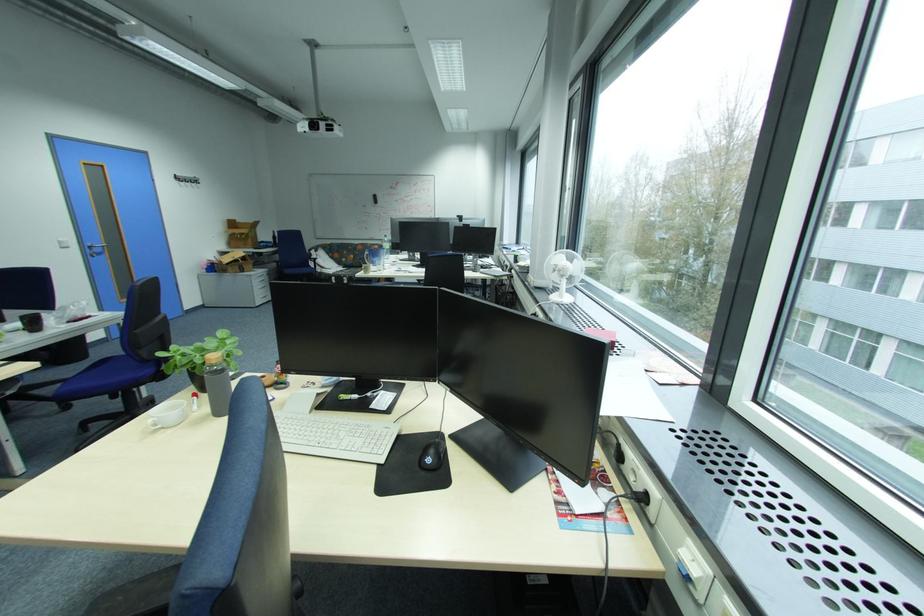
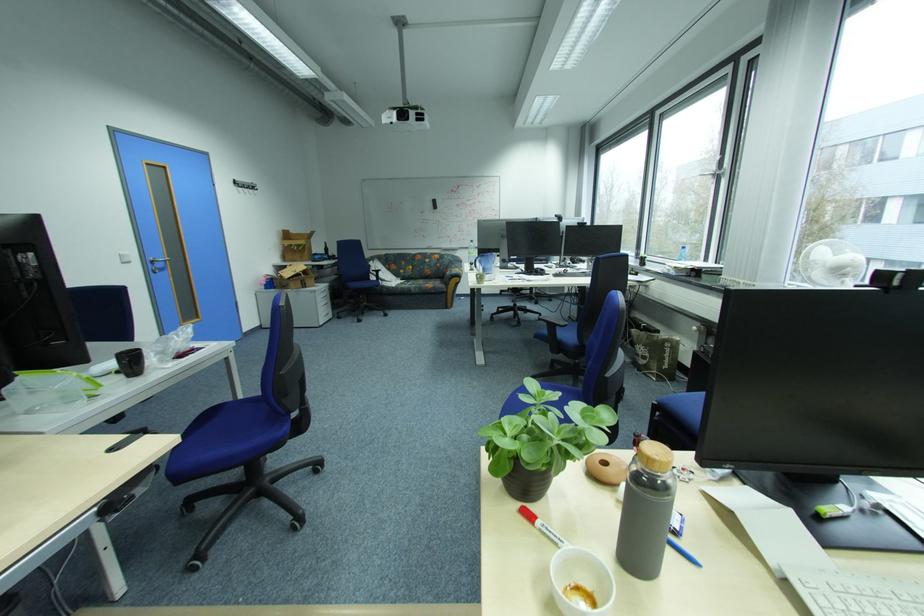
The point at (106, 252) is marked in the first image. Where is the corresponding point in the second image?

(167, 265)